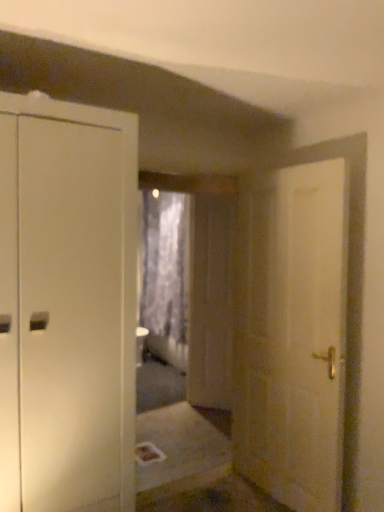
Question: From a real-world perspective, is transparent plastic screen door at center physically above gray textured curtain at center?

Choices:
 (A) yes
 (B) no

Answer: (B)

Question: Is the position of transparent plastic screen door at center more distant than that of gray textured curtain at center?

Choices:
 (A) no
 (B) yes

Answer: (A)

Question: Could you tell me if transparent plastic screen door at center is facing gray textured curtain at center?

Choices:
 (A) yes
 (B) no

Answer: (B)

Question: Considering the relative positions of transparent plastic screen door at center and gray textured curtain at center in the image provided, is transparent plastic screen door at center to the left of gray textured curtain at center from the viewer's perspective?

Choices:
 (A) yes
 (B) no

Answer: (B)

Question: From a real-world perspective, does transparent plastic screen door at center sit lower than gray textured curtain at center?

Choices:
 (A) no
 (B) yes

Answer: (B)

Question: Can you see transparent plastic screen door at center touching gray textured curtain at center?

Choices:
 (A) yes
 (B) no

Answer: (B)

Question: From a real-world perspective, is white matte door at right located beneath transparent plastic screen door at center?

Choices:
 (A) no
 (B) yes

Answer: (A)

Question: Is white matte door at right oriented away from transparent plastic screen door at center?

Choices:
 (A) yes
 (B) no

Answer: (B)

Question: Is transparent plastic screen door at center a part of white matte door at right?

Choices:
 (A) yes
 (B) no

Answer: (B)

Question: Is white matte door at right beside transparent plastic screen door at center?

Choices:
 (A) yes
 (B) no

Answer: (B)

Question: From the image's perspective, would you say white matte door at right is positioned over transparent plastic screen door at center?

Choices:
 (A) no
 (B) yes

Answer: (A)

Question: Is the depth of white matte door at right greater than that of transparent plastic screen door at center?

Choices:
 (A) yes
 (B) no

Answer: (B)

Question: Is transparent plastic screen door at center oriented towards white matte door at right?

Choices:
 (A) yes
 (B) no

Answer: (B)